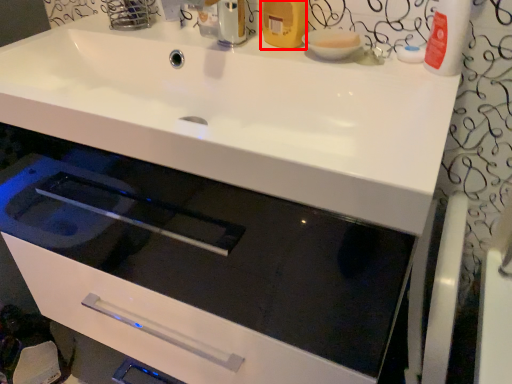
Question: From the image's perspective, where is toiletry (annotated by the red box) located in relation to basin in the image?

Choices:
 (A) above
 (B) below

Answer: (A)